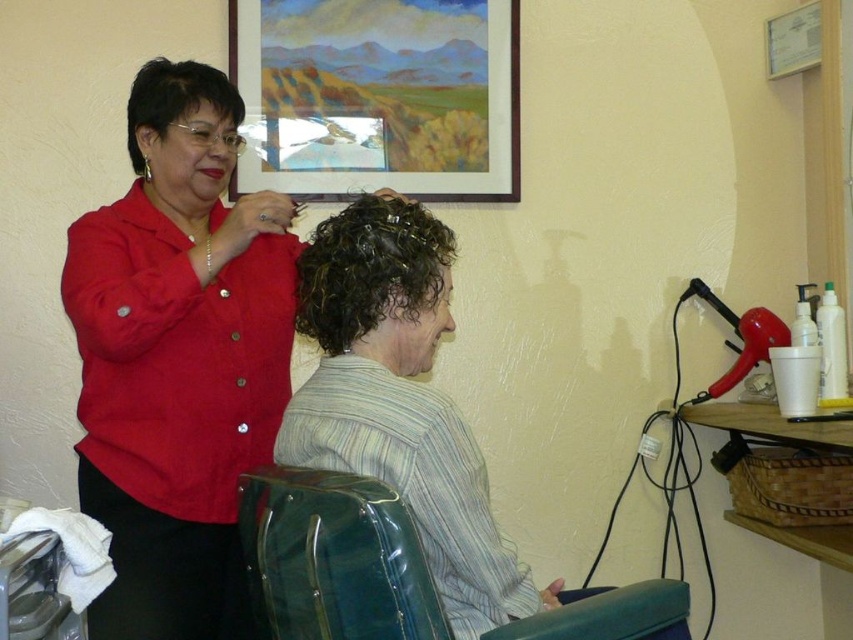
Question: Which of the following is the closest to the observer?

Choices:
 (A) (312, 488)
 (B) (148, 118)

Answer: (A)

Question: Is striped fabric shirt at center in front of wooden-framed painting at upper center?

Choices:
 (A) yes
 (B) no

Answer: (A)

Question: Which point appears closest to the camera in this image?

Choices:
 (A) (283, 51)
 (B) (318, 300)
 (C) (141, 108)

Answer: (B)

Question: Which object appears closest to the camera in this image?

Choices:
 (A) matte black hair clip at upper left
 (B) curly hair at center

Answer: (B)

Question: Is matte red blouse at upper left behind wooden-framed painting at upper center?

Choices:
 (A) yes
 (B) no

Answer: (B)

Question: Is matte red blouse at upper left closer to camera compared to wooden-framed painting at upper center?

Choices:
 (A) no
 (B) yes

Answer: (B)